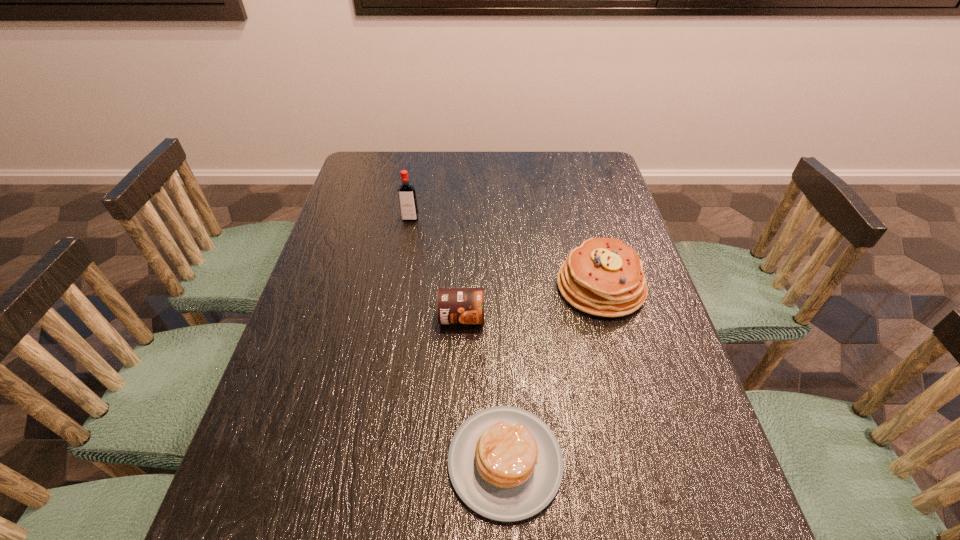
Where is `the farthest object`? Image resolution: width=960 pixels, height=540 pixels. the farthest object is located at coordinates (407, 198).

Locate an element on the screen. the leftmost object is located at coordinates (407, 198).

What are the coordinates of `the taller pancake` in the screenshot? It's located at (604, 277).

Locate an element on the screen. The image size is (960, 540). the rightmost object is located at coordinates (604, 277).

At what (x,y) coordinates should I click in order to perform the action: click on the third tallest object. Please return your answer as a coordinate pair (x, y). The height and width of the screenshot is (540, 960). Looking at the image, I should click on (454, 305).

The width and height of the screenshot is (960, 540). In order to click on the nearer pancake in this screenshot , I will do `click(505, 463)`.

Identify the location of the nearest object. [x=505, y=463].

At what (x,y) coordinates should I click in order to perform the action: click on vacant space positioned on the front and back of the leftmost object. Please return your answer as a coordinate pair (x, y). The image size is (960, 540). Looking at the image, I should click on (398, 284).

Find the location of a particular element. The height and width of the screenshot is (540, 960). free region located on the front of the rightmost object is located at coordinates (631, 399).

Locate an element on the screen. This screenshot has width=960, height=540. vacant space located on the front label of the can is located at coordinates (457, 452).